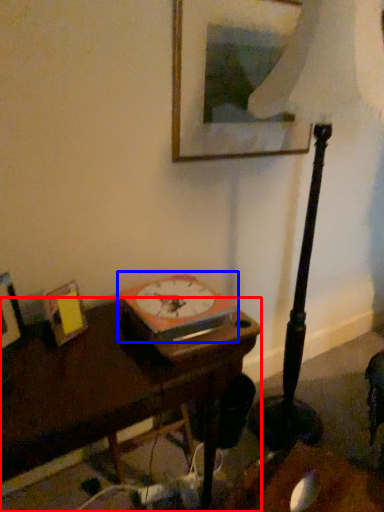
Question: Which object is further to the camera taking this photo, table (highlighted by a red box) or paperback book (highlighted by a blue box)?

Choices:
 (A) table
 (B) paperback book

Answer: (B)